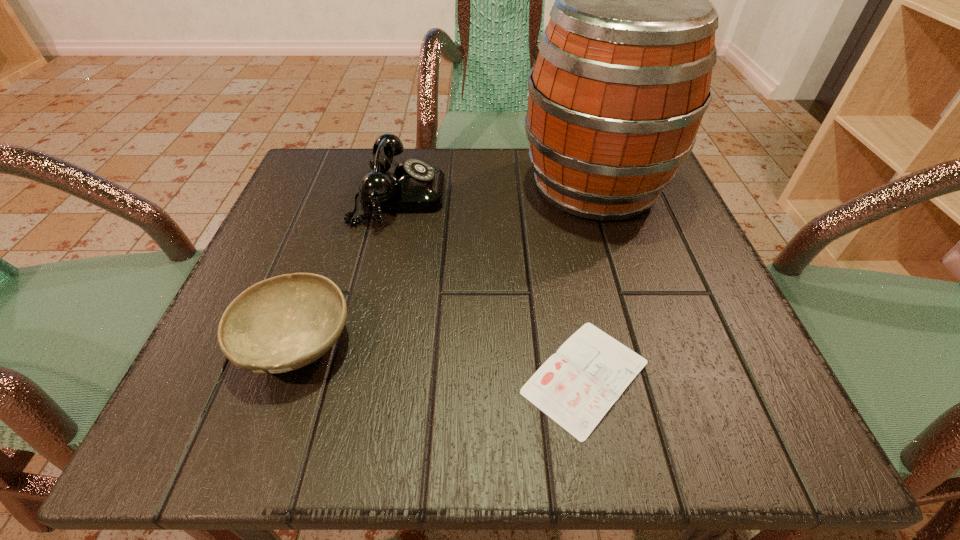
Find the location of a particular element. free spot that satisfies the following two spatial constraints: 1. on the back side of the cider; 2. on the right side of the shortest object is located at coordinates (549, 187).

Find the location of a particular element. This screenshot has width=960, height=540. free space that satisfies the following two spatial constraints: 1. on the front side of the third tallest object; 2. on the left side of the diary is located at coordinates (284, 376).

Where is `vacant space that satisfies the following two spatial constraints: 1. on the dial of the telephone; 2. on the right side of the shortest object`? This screenshot has width=960, height=540. vacant space that satisfies the following two spatial constraints: 1. on the dial of the telephone; 2. on the right side of the shortest object is located at coordinates (360, 376).

The image size is (960, 540). I want to click on vacant space that satisfies the following two spatial constraints: 1. on the front side of the cider; 2. on the dial of the telephone, so click(598, 197).

The width and height of the screenshot is (960, 540). I want to click on free space that satisfies the following two spatial constraints: 1. on the dial of the telephone; 2. on the front side of the third tallest object, so click(368, 342).